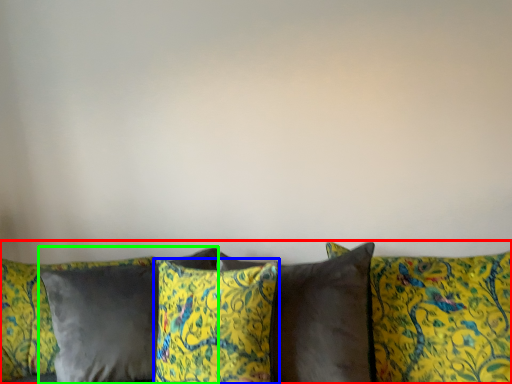
Question: Which is farther away from studio couch (highlighted by a red box)? pillow (highlighted by a blue box) or pillow (highlighted by a green box)?

Choices:
 (A) pillow
 (B) pillow

Answer: (B)